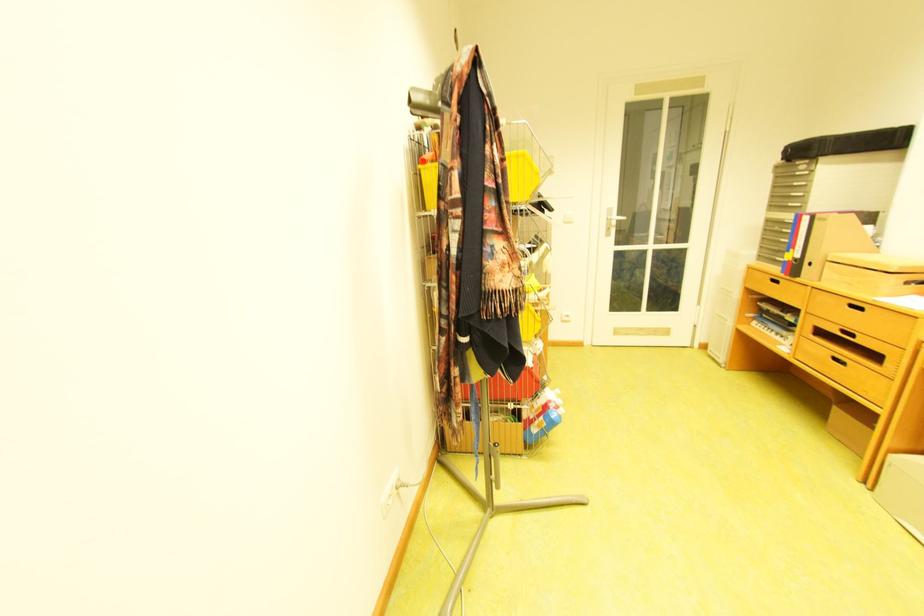
Find the location of `wooden box lid`. wooden box lid is located at coordinates (873, 274).